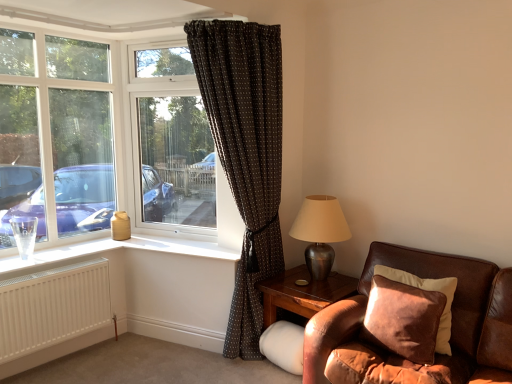
The height and width of the screenshot is (384, 512). Describe the element at coordinates (302, 293) in the screenshot. I see `wooden side table at lower right` at that location.

I want to click on brown corduroy pillow at lower right, so click(x=428, y=292).

What do you see at coordinates (428, 292) in the screenshot? I see `brown corduroy pillow at lower right` at bounding box center [428, 292].

Measure the distance between transparent glass window at center and camera.

3.57 meters.

Describe the element at coordinates (417, 275) in the screenshot. The image size is (512, 384). I see `brown leather couch at lower right` at that location.

What do you see at coordinates (245, 154) in the screenshot?
I see `brown dotted fabric curtain at left` at bounding box center [245, 154].

Where is `white plastic window frame at left`? Image resolution: width=512 pixels, height=384 pixels. white plastic window frame at left is located at coordinates (55, 135).

Is metallic silver table lamp at right outside of brown leather couch at lower right?

metallic silver table lamp at right is positioned outside brown leather couch at lower right.

From the image's perspective, is metallic silver table lamp at right located beneath brown leather couch at lower right?

No, from the image's perspective, metallic silver table lamp at right is not beneath brown leather couch at lower right.

Find the location of a particular element. The height and width of the screenshot is (384, 512). table lamp on the left of brown leather couch at lower right is located at coordinates (320, 232).

Is metallic silver table lamp at right positioned before brown leather couch at lower right?

No, it is not.

Does point (310, 234) appear closer or farther from the camera than point (266, 114)?

Point (310, 234).

Is metallic silver table lamp at right in front of or behind brown dotted fabric curtain at left in the image?

Visually, metallic silver table lamp at right is located behind brown dotted fabric curtain at left.

How distant is metallic silver table lamp at right from brown dotted fabric curtain at left?

20.81 inches.

Could you tell me if metallic silver table lamp at right is facing brown dotted fabric curtain at left?

No, metallic silver table lamp at right is not facing towards brown dotted fabric curtain at left.

In the image, is metallic silver table lamp at right on the left side or the right side of brown corduroy pillow at lower right?

metallic silver table lamp at right is to the left of brown corduroy pillow at lower right.

From a real-world perspective, is metallic silver table lamp at right on top of brown corduroy pillow at lower right?

Yes.

You are a GUI agent. You are given a task and a screenshot of the screen. Output one action in this format:
    pyautogui.click(x=<x>, y=<y>)
    Task: Click on the pillow located underneath the metallic silver table lamp at right (from a real-world perspective)
    The image size is (512, 384).
    Given the screenshot: What is the action you would take?
    pyautogui.click(x=428, y=292)

Which is behind, white plastic window frame at left or brown dotted fabric curtain at left?

white plastic window frame at left is further away from the camera.

Is point (40, 189) positioned behind point (255, 87)?

Yes.

Would you say brown dotted fabric curtain at left is part of white plastic window frame at left's contents?

No, brown dotted fabric curtain at left is not a part of white plastic window frame at left.

In the image, there is a transparent glass window at center. Identify the location of table lamp below it (from the image's perspective). This screenshot has height=384, width=512. (320, 232).

Does metallic silver table lamp at right have a lesser height compared to transparent glass window at center?

Correct, metallic silver table lamp at right is not as tall as transparent glass window at center.

Does metallic silver table lamp at right have a greater width compared to transparent glass window at center?

Correct, the width of metallic silver table lamp at right exceeds that of transparent glass window at center.

Is brown corduroy pillow at lower right spatially inside metallic silver table lamp at right, or outside of it?

brown corduroy pillow at lower right lies outside metallic silver table lamp at right.

Who is smaller, brown corduroy pillow at lower right or metallic silver table lamp at right?

With smaller size is brown corduroy pillow at lower right.

Is brown corduroy pillow at lower right far from metallic silver table lamp at right?

No.

From the image's perspective, between brown dotted fabric curtain at left and brown corduroy pillow at lower right, which one is located above?

From the image's view, brown dotted fabric curtain at left is above.

From a real-world perspective, is brown dotted fabric curtain at left physically located above or below brown corduroy pillow at lower right?

brown dotted fabric curtain at left is situated higher than brown corduroy pillow at lower right in the real world.

Which is in front, brown dotted fabric curtain at left or brown corduroy pillow at lower right?

Positioned in front is brown corduroy pillow at lower right.

Locate an element on the screen. table lamp on the left of brown leather couch at lower right is located at coordinates (320, 232).

Identify the location of table lamp behind the brown dotted fabric curtain at left. The width and height of the screenshot is (512, 384). (320, 232).

Based on the photo, estimate the real-world distances between objects in this image. Which object is closer to brown corduroy pillow at lower right, transparent glass window at center or brown leather couch at lower right?

Among the two, brown leather couch at lower right is located nearer to brown corduroy pillow at lower right.

Looking at this image, based on their spatial positions, is wooden side table at lower right or white matte radiator at lower left further from brown leather couch at lower right?

white matte radiator at lower left is positioned further to the anchor brown leather couch at lower right.

Considering their positions, is white matte radiator at lower left positioned further to brown corduroy pillow at lower right than transparent glass window at center?

white matte radiator at lower left is further to brown corduroy pillow at lower right.

When comparing their distances from white matte radiator at lower left, does brown dotted fabric curtain at left or brown corduroy pillow at lower right seem further?

The object further to white matte radiator at lower left is brown corduroy pillow at lower right.

From the image, which object appears to be nearer to brown corduroy pillow at lower right, brown dotted fabric curtain at left or transparent glass window at center?

Among the two, brown dotted fabric curtain at left is located nearer to brown corduroy pillow at lower right.

Considering their positions, is brown leather couch at lower right positioned closer to brown corduroy pillow at lower right than metallic silver table lamp at right?

brown leather couch at lower right lies closer to brown corduroy pillow at lower right than the other object.

Estimate the real-world distances between objects in this image. Which object is closer to brown dotted fabric curtain at left, metallic silver table lamp at right or transparent glass window at center?

metallic silver table lamp at right.

Considering their positions, is brown leather couch at lower right positioned further to wooden side table at lower right than white plastic window frame at left?

white plastic window frame at left lies further to wooden side table at lower right than the other object.

In order to click on window screen located between white plastic window frame at left and metallic silver table lamp at right in the left-right direction in this screenshot , I will do `click(176, 161)`.

Identify the location of pillow between white plastic window frame at left and brown leather couch at lower right from left to right. (428, 292).

Find the location of a particular element. pillow between white matte radiator at lower left and brown leather couch at lower right is located at coordinates (428, 292).

This screenshot has width=512, height=384. I want to click on curtain situated between white matte radiator at lower left and brown corduroy pillow at lower right from left to right, so click(245, 154).